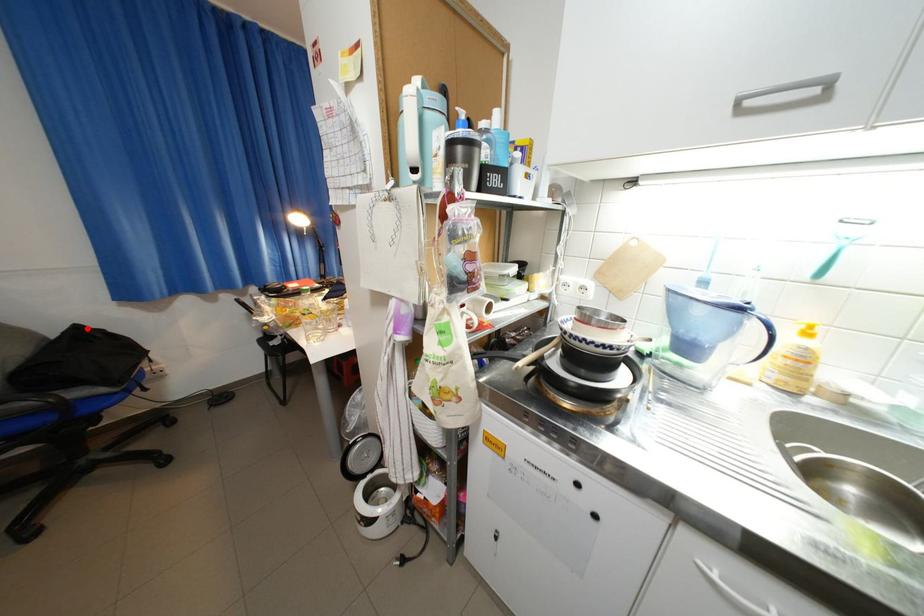
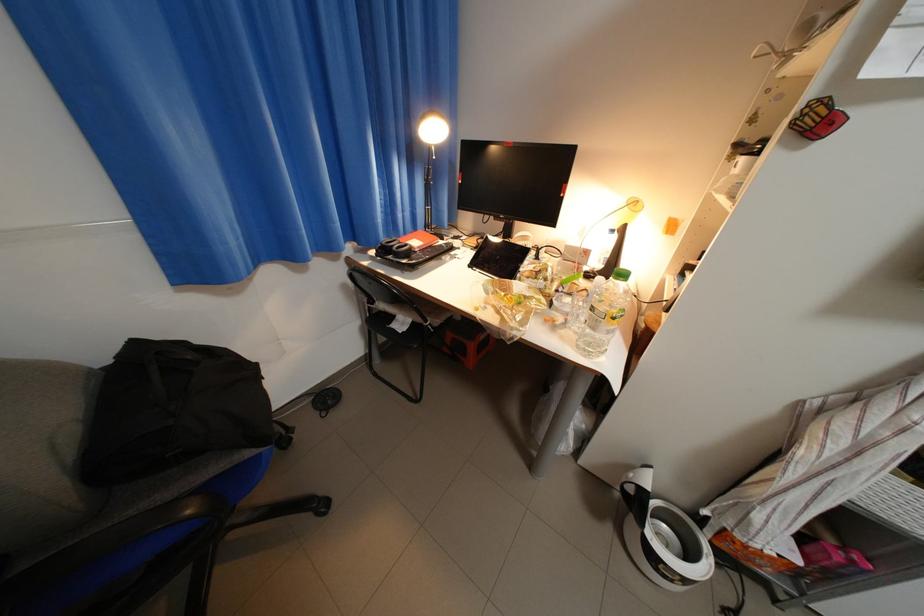
In the second image, find the point that corresponds to the highlighted location in the first image.

(147, 344)